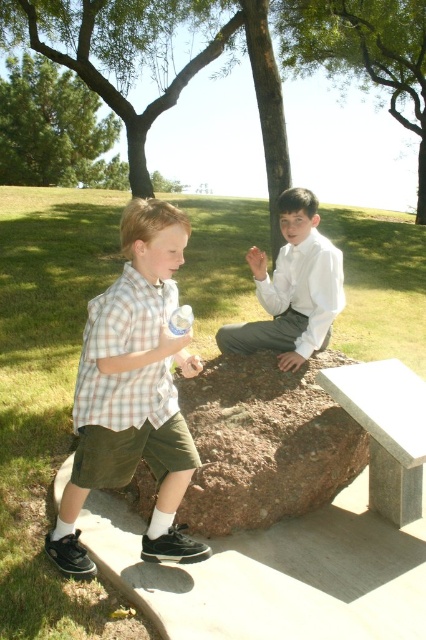
Does point (123, 355) lie behind point (275, 518)?

No, (123, 355) is closer to viewer.

Describe the element at coordinates (132, 390) in the screenshot. The width and height of the screenshot is (426, 640). I see `plaid cotton shirt at left` at that location.

Describe the element at coordinates (132, 390) in the screenshot. I see `plaid cotton shirt at left` at that location.

The height and width of the screenshot is (640, 426). Find the location of `plaid cotton shirt at left`. plaid cotton shirt at left is located at coordinates (132, 390).

This screenshot has width=426, height=640. Describe the element at coordinates (293, 289) in the screenshot. I see `white satin shirt at center` at that location.

Does point (313, 340) lie in front of point (419, 458)?

No, it is behind (419, 458).

I want to click on white satin shirt at center, so click(293, 289).

Consider the image. Does plaid cotton shirt at left come behind white satin shirt at center?

No, it is not.

Between plaid cotton shirt at left and white satin shirt at center, which one is positioned higher?

white satin shirt at center

Find the location of a particular element. The width and height of the screenshot is (426, 640). plaid cotton shirt at left is located at coordinates (132, 390).

What are the coordinates of `plaid cotton shirt at left` in the screenshot? It's located at (132, 390).